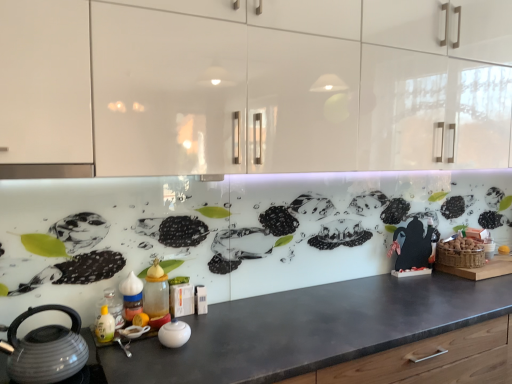
Where is `free space on the front side of translucent plastic spice jar at center, the 2th bottle when ordered from right to left`? free space on the front side of translucent plastic spice jar at center, the 2th bottle when ordered from right to left is located at coordinates (125, 339).